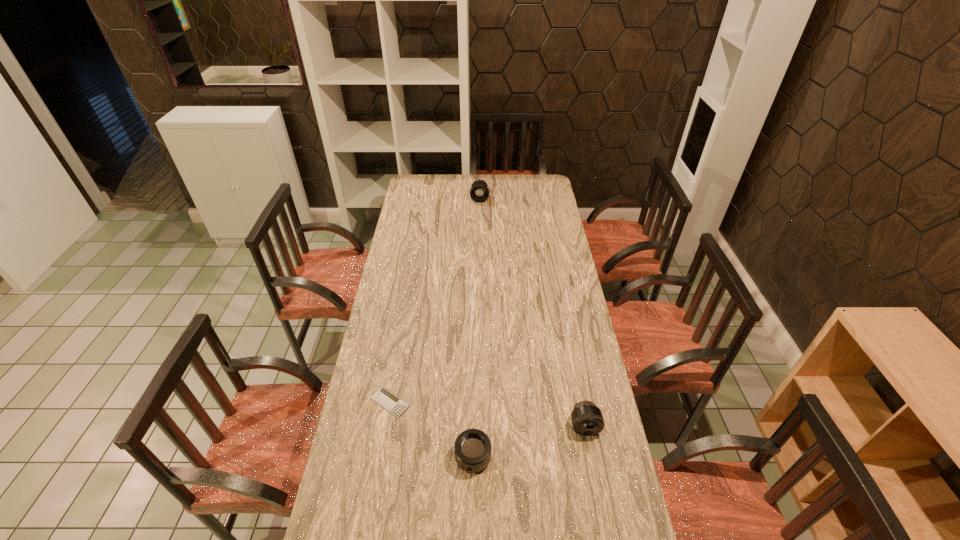
Locate an element on the screen. vacant space located 0.200m on the front of the shortest object is located at coordinates click(x=377, y=476).

The image size is (960, 540). What are the coordinates of `object at the far edge` in the screenshot? It's located at (479, 192).

Identify the location of object at the left edge. The height and width of the screenshot is (540, 960). (389, 401).

The height and width of the screenshot is (540, 960). What are the coordinates of `object at the right edge` in the screenshot? It's located at (587, 419).

Where is `blank space at the far edge of the desktop`? This screenshot has width=960, height=540. blank space at the far edge of the desktop is located at coordinates (500, 178).

In the image, there is a desktop. At what (x,y) coordinates should I click in order to perform the action: click on vacant region at the left edge. Please return your answer as a coordinate pair (x, y). Looking at the image, I should click on (405, 222).

Image resolution: width=960 pixels, height=540 pixels. What are the coordinates of `vacant space at the right edge of the desktop` in the screenshot? It's located at (540, 238).

Where is `vacant point at the far left corner`? vacant point at the far left corner is located at coordinates (412, 180).

Image resolution: width=960 pixels, height=540 pixels. In the image, there is a desktop. Identify the location of blank space at the far right corner. (535, 184).

At what (x,y) coordinates should I click in order to perform the action: click on empty location between the second farthest telephoto lens and the farthest telephoto lens. Please return your answer as a coordinate pair (x, y). This screenshot has width=960, height=540. Looking at the image, I should click on (532, 312).